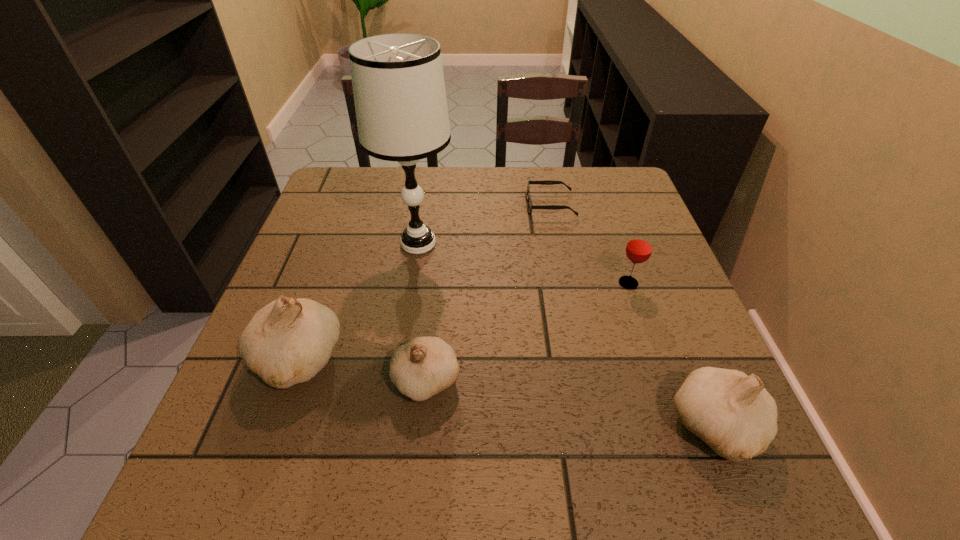
Find the location of a particular element. The image size is (960, 540). vacant region between the glass and the second tallest garlic is located at coordinates (672, 355).

Find the location of `vacant area that lies between the second farthest object and the shortest garlic`. vacant area that lies between the second farthest object and the shortest garlic is located at coordinates (422, 312).

Identify the location of vacant region between the leftmost garlic and the second shortest object. (362, 370).

I want to click on vacant point located between the third object from right to left and the second tallest garlic, so click(x=634, y=316).

Where is `vacant area between the shortest object and the leftmost garlic`? The image size is (960, 540). vacant area between the shortest object and the leftmost garlic is located at coordinates (424, 283).

Locate an element on the screen. free spot between the rightmost garlic and the table lamp is located at coordinates (567, 335).

This screenshot has width=960, height=540. I want to click on vacant space that's between the glass and the farthest object, so click(589, 244).

The image size is (960, 540). I want to click on free spot between the rightmost garlic and the leftmost object, so click(507, 394).

Identify the location of the third closest object to the leftmost garlic. Image resolution: width=960 pixels, height=540 pixels. (546, 182).

Identify the location of object that ranks as the fourth closest to the table lamp. Image resolution: width=960 pixels, height=540 pixels. (639, 247).